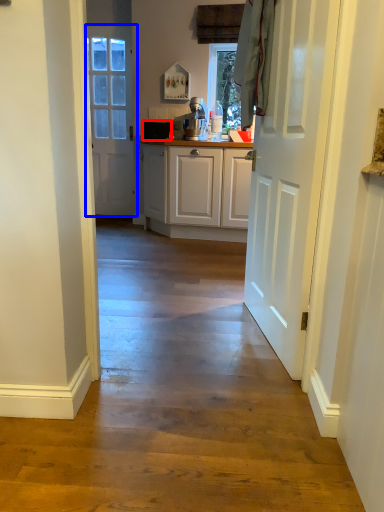
Question: Which object appears farthest to the camera in this image, appliance (highlighted by a red box) or door (highlighted by a blue box)?

Choices:
 (A) appliance
 (B) door

Answer: (B)